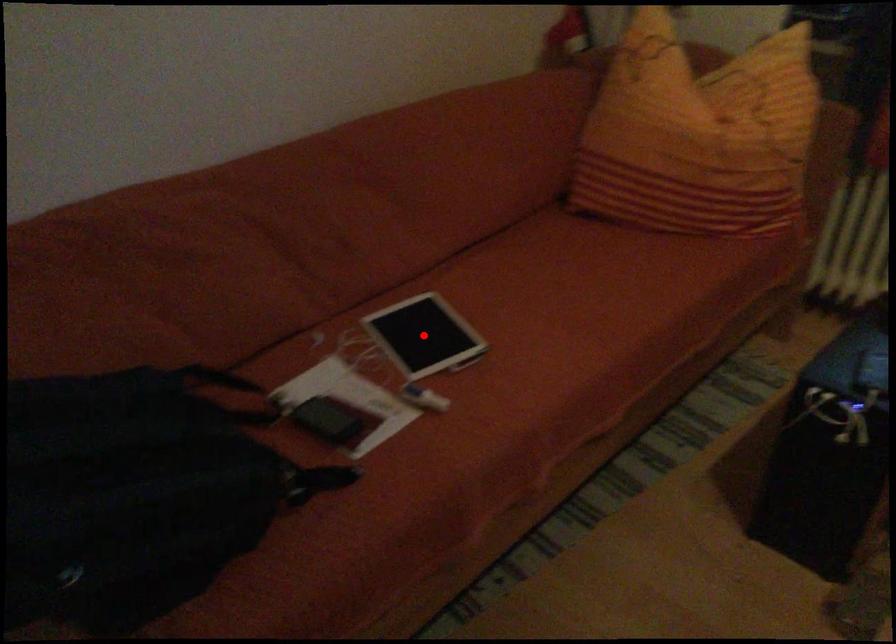
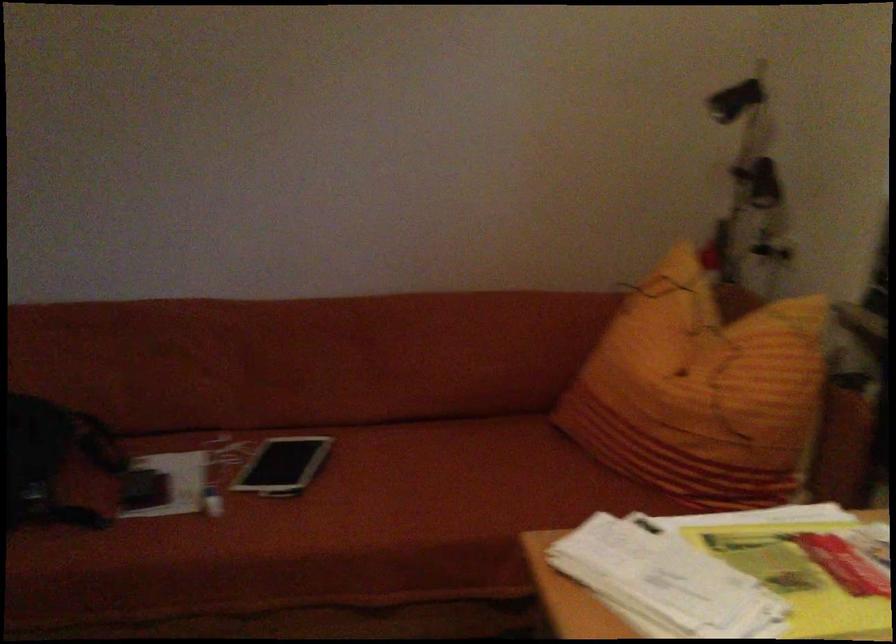
Question: I am providing you with two images of the same scene from different viewpoints. A red point is marked on the first image. Is the red point's position out of view in image 2?

Choices:
 (A) Yes
 (B) No

Answer: (A)